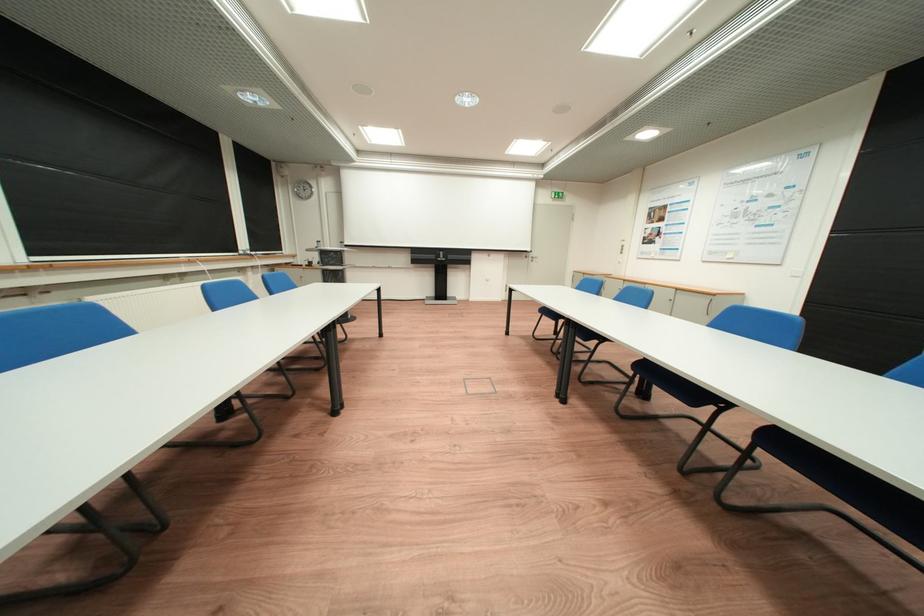
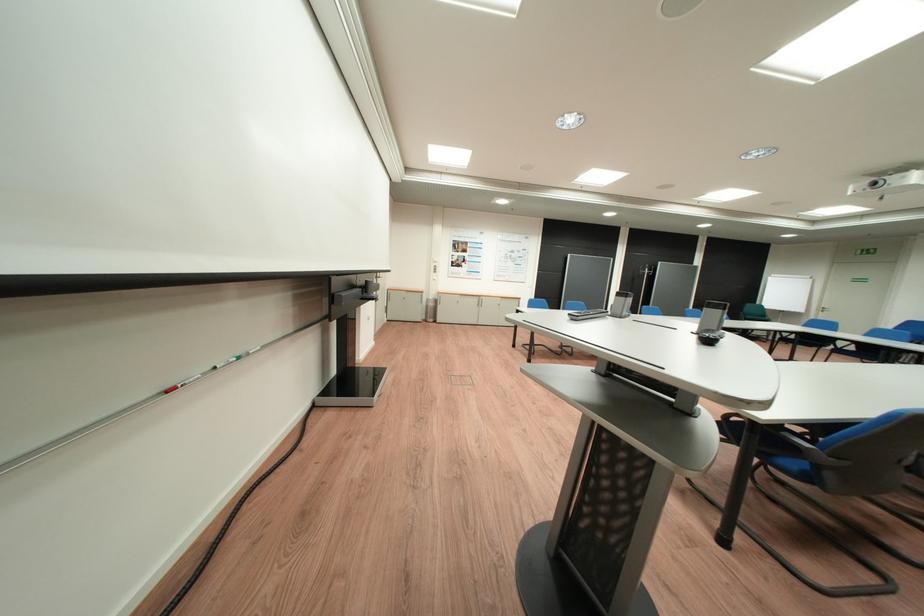
Question: I am providing you with two images of the same scene from different viewpoints. After the viewpoint changes to image2, which objects are now occluded?

Choices:
 (A) small cabinet lock
 (B) white whiteboard marker
 (C) blue chair sitting surface
 (D) green whiteboard marker

Answer: (C)